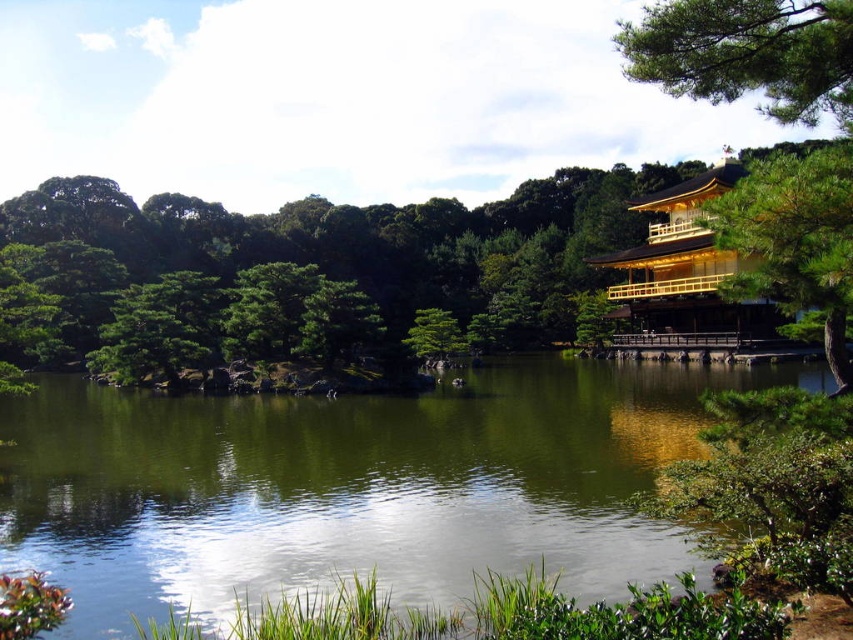
Measure the distance between point (369, 221) and camera.

142.49 meters

Does point (49, 268) come farther from viewer compared to point (642, 317)?

Yes, it is behind point (642, 317).

Where is `green leafy tree at upper right`? Image resolution: width=853 pixels, height=640 pixels. green leafy tree at upper right is located at coordinates (346, 250).

Which is in front, point (546, 435) or point (718, 22)?

Point (718, 22) is in front.

Consider the image. Who is higher up, green liquid water at center or green pine tree at upper right?

Positioned higher is green pine tree at upper right.

Does point (276, 524) lie in front of point (769, 26)?

No, it is behind (769, 26).

The height and width of the screenshot is (640, 853). I want to click on green liquid water at center, so click(352, 484).

Does green liquid water at center appear on the right side of green leafy tree at upper right?

Incorrect, green liquid water at center is not on the right side of green leafy tree at upper right.

Which is more to the right, green liquid water at center or green leafy tree at upper right?

green leafy tree at upper right

Who is more distant from viewer, (456, 476) or (521, 305)?

The point (521, 305) is behind.

Where is `green liquid water at center`? The image size is (853, 640). green liquid water at center is located at coordinates (352, 484).